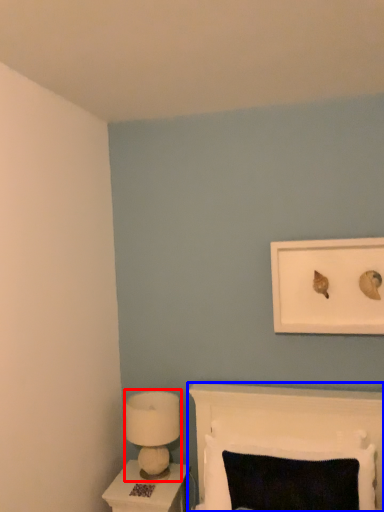
Question: Among these objects, which one is farthest to the camera, lamp (highlighted by a red box) or furniture (highlighted by a blue box)?

Choices:
 (A) lamp
 (B) furniture

Answer: (A)